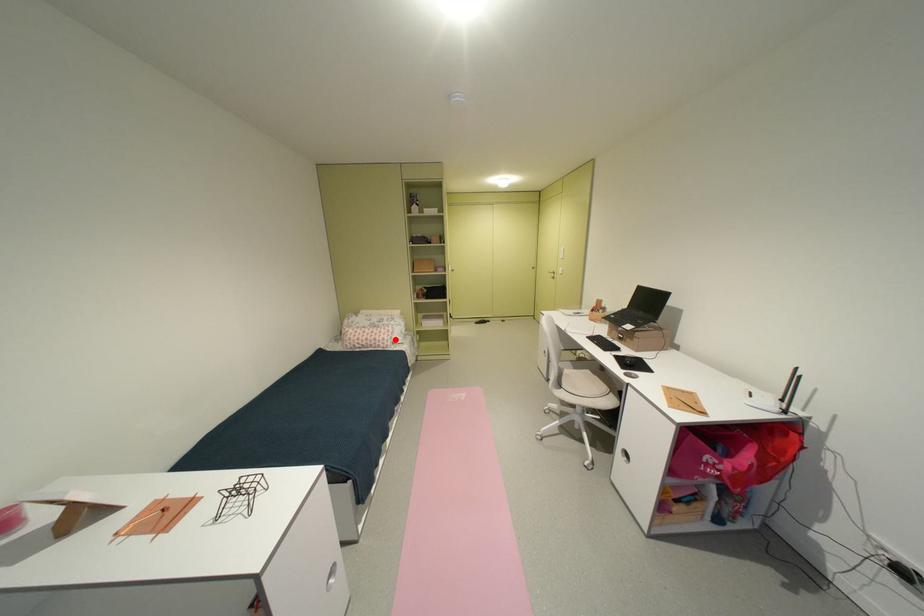
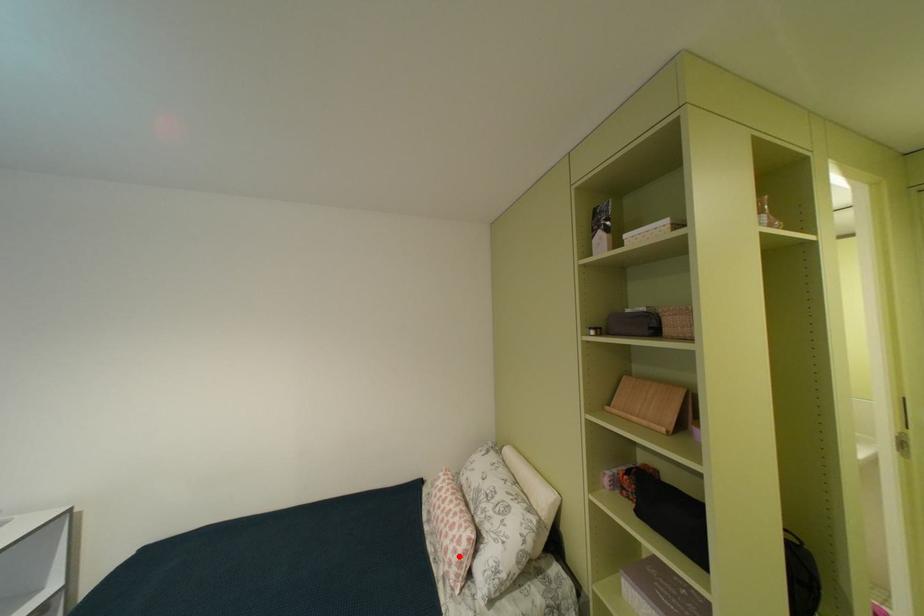
I am providing you with two images of the same scene from different viewpoints. A red point is marked on the first image and another point is marked on the second image. Do the highlighted points in image1 and image2 indicate the same real-world spot?

Yes